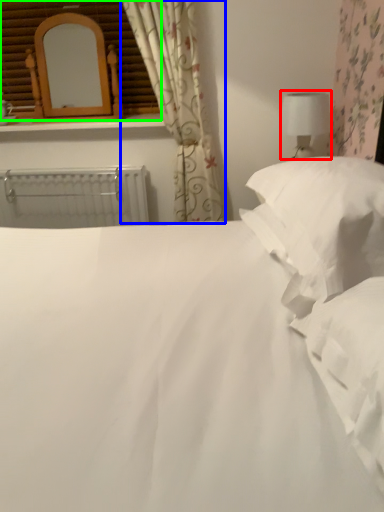
Question: Which object is positioned farthest from table lamp (highlighted by a red box)? Select from curtain (highlighted by a blue box) and window frame (highlighted by a green box).

Choices:
 (A) curtain
 (B) window frame

Answer: (B)